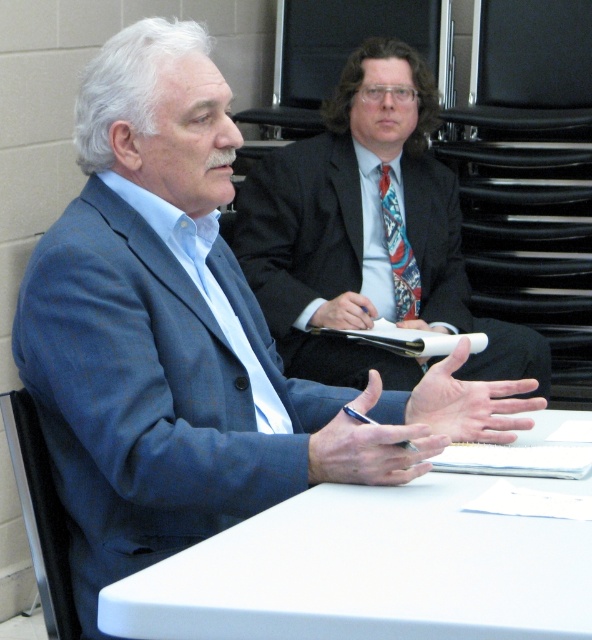
Question: Which point is farther to the camera?

Choices:
 (A) white plastic table at center
 (B) dark blue wool suit at center

Answer: (B)

Question: Which point is farther to the camera?

Choices:
 (A) multicolored woven tie at center
 (B) dark blue wool suit at center

Answer: (A)

Question: Is white plastic table at center smaller than multicolored woven tie at center?

Choices:
 (A) yes
 (B) no

Answer: (B)

Question: Is dark blue wool suit at center bigger than multicolored woven tie at center?

Choices:
 (A) yes
 (B) no

Answer: (A)

Question: Can you confirm if dark blue wool suit at center is wider than multicolored woven tie at center?

Choices:
 (A) yes
 (B) no

Answer: (A)

Question: Which point is closer to the camera?

Choices:
 (A) (291, 333)
 (B) (294, 636)

Answer: (B)